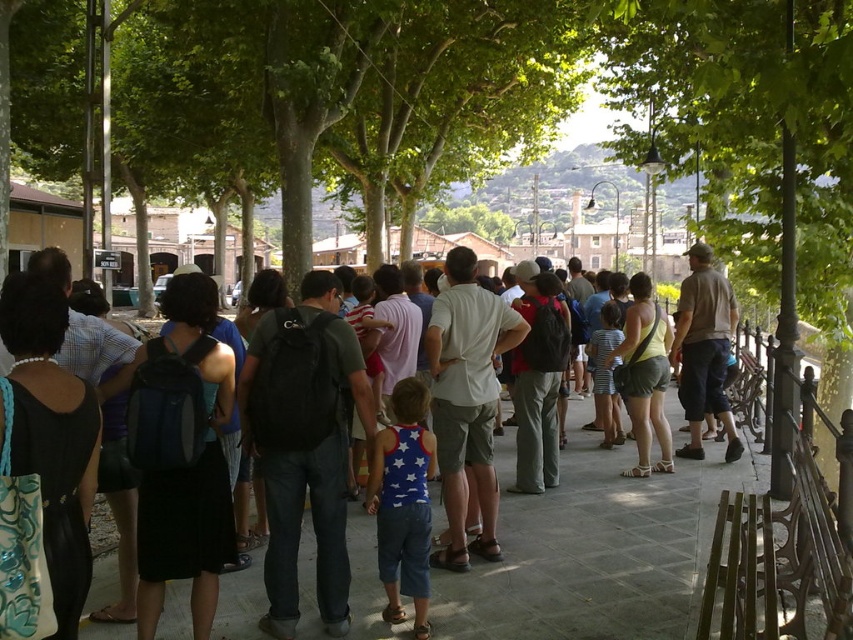
Question: From the image, what is the correct spatial relationship of gray concrete pavement at center in relation to blue denim shorts at center?

Choices:
 (A) right
 (B) left

Answer: (A)

Question: In this image, where is gray concrete pavement at center located relative to white cotton shirt at center?

Choices:
 (A) above
 (B) below

Answer: (B)

Question: Among these points, which one is farthest from the camera?

Choices:
 (A) (641, 449)
 (B) (445, 369)
 (C) (727, 410)
 (D) (529, 326)

Answer: (C)

Question: Which object is positioned closest to the khaki cotton shirt at center?

Choices:
 (A) white cotton shirt at center
 (B) blue denim shorts at center
 (C) black matte backpack at center
 (D) gray concrete pavement at center

Answer: (A)

Question: Where is gray concrete pavement at center located in relation to white cotton shirt at center in the image?

Choices:
 (A) right
 (B) left

Answer: (A)

Question: Which object is positioned closest to the black matte backpack at center?

Choices:
 (A) matte black backpack at center
 (B) white cotton shirt at center

Answer: (B)